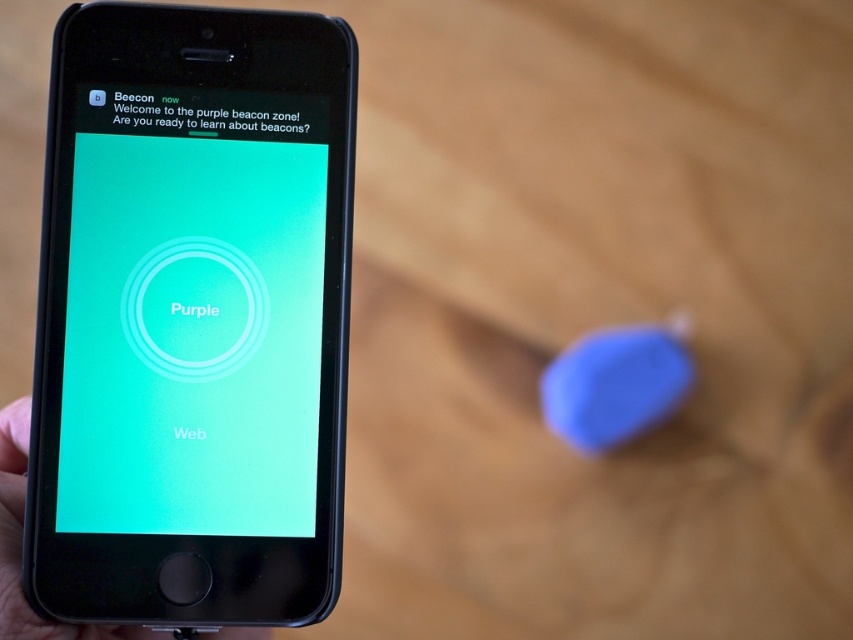
You are trying to take a photo of the beacon in the background. Which object, the matte black smartphone at left or the matte black phone at lower left, is closer to you and would block your view of the beacon?

The matte black smartphone at left is closer to you than the matte black phone at lower left. Since the matte black phone at lower left is behind the matte black smartphone at left, the smartphone would block your view of the beacon.

You are holding a matte black smartphone at left and see another matte black phone at lower left in the background. Which one is positioned higher in the image?

The matte black smartphone at left is positioned higher than the matte black phone at lower left.

You are holding the matte black phone at lower left and want to place it closer to the purple matte beacon at upper left. If you move it 5 inches towards the beacon, will the phone now be within 5 inches of the beacon?

The purple matte beacon at upper left is 9.99 inches away from the matte black phone at lower left. Moving the phone 5 inches closer reduces the distance to 4.99 inches, which is within the 5 inches threshold. Yes, the phone will now be within 5 inches of the beacon.